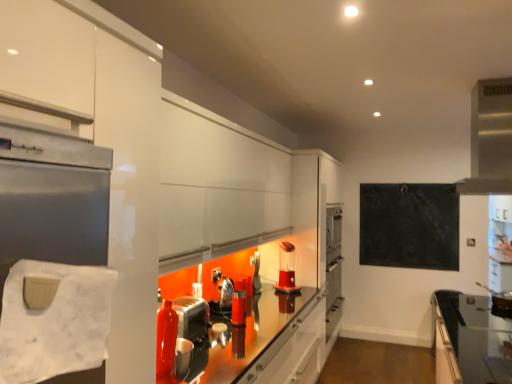
Describe the element at coordinates (470, 340) in the screenshot. The width and height of the screenshot is (512, 384). I see `black glass countertop at lower right` at that location.

At what (x,y) coordinates should I click in order to perform the action: click on metallic silver toaster at center, arranged as the 3th appliance when viewed from the back. Please return your answer as a coordinate pair (x, y). The width and height of the screenshot is (512, 384). Looking at the image, I should click on pos(238,308).

The width and height of the screenshot is (512, 384). What do you see at coordinates (490, 139) in the screenshot?
I see `satin silver exhaust hood at upper right` at bounding box center [490, 139].

What do you see at coordinates (55, 323) in the screenshot? I see `white paper towel at left` at bounding box center [55, 323].

What do you see at coordinates (221, 292) in the screenshot?
I see `shiny metallic kettle at center, the 2th appliance viewed from the back` at bounding box center [221, 292].

Identify the location of translucent plastic coffee machine at center. (287, 268).

Consider the image. Does white paper towel at left appear on the right side of shiny metallic kettle at center, the second appliance viewed from the front?

In fact, white paper towel at left is to the left of shiny metallic kettle at center, the second appliance viewed from the front.

In terms of width, does white paper towel at left look wider or thinner when compared to shiny metallic kettle at center, the second appliance viewed from the front?

Clearly, white paper towel at left has less width compared to shiny metallic kettle at center, the second appliance viewed from the front.

Which appliance is the 2nd one when counting from the back of the white paper towel at left? Please provide its 2D coordinates.

[(221, 292)]

From a real-world perspective, which is physically below, white paper towel at left or shiny metallic kettle at center, the 2th appliance viewed from the back?

shiny metallic kettle at center, the 2th appliance viewed from the back, from a real-world perspective.

Does white paper towel at left have a greater width compared to translucent plastic coffee machine at center?

No, white paper towel at left is not wider than translucent plastic coffee machine at center.

Is white paper towel at left surrounding translucent plastic coffee machine at center?

No.

From the picture: From a real-world perspective, which object rests below the other?

translucent plastic coffee machine at center.

Could you tell me if white paper towel at left is facing translucent plastic coffee machine at center?

No.

Based on the photo, from the image's perspective, is shiny metallic kettle at center, the 2th appliance viewed from the back, above or below black slate board at upper right?

Based on their image positions, shiny metallic kettle at center, the 2th appliance viewed from the back, is located beneath black slate board at upper right.

Is shiny metallic kettle at center, the 2th appliance viewed from the back, next to black slate board at upper right and touching it?

No, shiny metallic kettle at center, the 2th appliance viewed from the back, is not making contact with black slate board at upper right.

Is point (226, 285) positioned in front of point (412, 244)?

Yes, point (226, 285) is in front of point (412, 244).

From the image's perspective, would you say white paper towel at left is shown under black glass countertop at lower right?

Actually, white paper towel at left appears above black glass countertop at lower right in the image.

How far apart are white paper towel at left and black glass countertop at lower right?

white paper towel at left is 11.87 feet away from black glass countertop at lower right.

Is white paper towel at left at the left side of black glass countertop at lower right?

Correct, you'll find white paper towel at left to the left of black glass countertop at lower right.

Relative to black glass countertop at lower right, is white paper towel at left in front or behind?

white paper towel at left is in front of black glass countertop at lower right.

Does point (507, 118) come in front of point (255, 257)?

Yes, point (507, 118) is in front of point (255, 257).

Can you confirm if satin silver exhaust hood at upper right is wider than metallic silver toaster at center, which is the third appliance from front to back?

Yes.

Considering the sizes of objects satin silver exhaust hood at upper right and metallic silver toaster at center, which is the third appliance from front to back, in the image provided, who is shorter, satin silver exhaust hood at upper right or metallic silver toaster at center, which is the third appliance from front to back,?

Standing shorter between the two is metallic silver toaster at center, which is the third appliance from front to back.

In the image, is translucent plastic coffee machine at center on the left side or the right side of shiny metallic kettle at center, the second appliance viewed from the front?

Clearly, translucent plastic coffee machine at center is on the right of shiny metallic kettle at center, the second appliance viewed from the front, in the image.

Between translucent plastic coffee machine at center and shiny metallic kettle at center, the second appliance viewed from the front, which one is positioned in front?

Positioned in front is shiny metallic kettle at center, the second appliance viewed from the front.

Between point (283, 281) and point (224, 295), which one is positioned behind?

The point (283, 281) is farther from the camera.

Are translucent plastic coffee machine at center and shiny metallic kettle at center, the second appliance viewed from the front, making contact?

No, translucent plastic coffee machine at center is not making contact with shiny metallic kettle at center, the second appliance viewed from the front.

Which is more distant, (x=288, y=289) or (x=245, y=300)?

Positioned behind is point (x=288, y=289).

Based on the photo, considering the relative positions of translucent plastic coffee machine at center and metallic silver toaster at center, arranged as the 3th appliance when viewed from the back, in the image provided, is translucent plastic coffee machine at center to the left or to the right of metallic silver toaster at center, arranged as the 3th appliance when viewed from the back,?

In the image, translucent plastic coffee machine at center appears on the right side of metallic silver toaster at center, arranged as the 3th appliance when viewed from the back.

How far apart are translucent plastic coffee machine at center and metallic silver toaster at center, arranged as the 3th appliance when viewed from the back?

translucent plastic coffee machine at center is 38.43 inches from metallic silver toaster at center, arranged as the 3th appliance when viewed from the back.

Who is bigger, translucent plastic coffee machine at center or metallic silver toaster at center, which appears as the 1th appliance when viewed from the front?

Bigger between the two is translucent plastic coffee machine at center.

Find the location of a particular element. toilet paper above the shiny metallic kettle at center, the second appliance viewed from the front (from the image's perspective) is located at coordinates (55, 323).

Where is `coffee machine that is on the right side of white paper towel at left`? This screenshot has width=512, height=384. coffee machine that is on the right side of white paper towel at left is located at coordinates (287, 268).

Looking at the image, which one is located further to metallic silver toaster at center, acting as the first appliance starting from the back, satin silver exhaust hood at upper right or metallic silver toaster at center, arranged as the 3th appliance when viewed from the back?

Among the two, satin silver exhaust hood at upper right is located further to metallic silver toaster at center, acting as the first appliance starting from the back.

Which object lies further to the anchor point metallic silver toaster at center, which is the third appliance from front to back, shiny metallic kettle at center, the 2th appliance viewed from the back, or translucent plastic coffee machine at center?

shiny metallic kettle at center, the 2th appliance viewed from the back, is positioned further to the anchor metallic silver toaster at center, which is the third appliance from front to back.

Looking at the image, which one is located closer to black slate board at upper right, shiny metallic kettle at center, the 2th appliance viewed from the back, or black glass countertop at lower right?

Based on the image, black glass countertop at lower right appears to be nearer to black slate board at upper right.

Considering their positions, is metallic silver toaster at center, which is the third appliance from front to back, positioned closer to metallic silver toaster at center, which appears as the 1th appliance when viewed from the front, than white paper towel at left?

metallic silver toaster at center, which is the third appliance from front to back, is closer to metallic silver toaster at center, which appears as the 1th appliance when viewed from the front.

Considering their positions, is metallic silver toaster at center, which is the third appliance from front to back, positioned further to black glass countertop at lower right than translucent plastic coffee machine at center?

Among the two, metallic silver toaster at center, which is the third appliance from front to back, is located further to black glass countertop at lower right.

Based on their spatial positions, is metallic silver toaster at center, arranged as the 3th appliance when viewed from the back, or white paper towel at left further from shiny metallic kettle at center, the 2th appliance viewed from the back?

white paper towel at left lies further to shiny metallic kettle at center, the 2th appliance viewed from the back, than the other object.

Based on their spatial positions, is black slate board at upper right or translucent plastic coffee machine at center closer to metallic silver toaster at center, which appears as the 1th appliance when viewed from the front?

translucent plastic coffee machine at center is positioned closer to the anchor metallic silver toaster at center, which appears as the 1th appliance when viewed from the front.

From the image, which object appears to be farther from shiny metallic kettle at center, the 2th appliance viewed from the back, white paper towel at left or translucent plastic coffee machine at center?

Among the two, white paper towel at left is located further to shiny metallic kettle at center, the 2th appliance viewed from the back.

At what (x,y) coordinates should I click in order to perform the action: click on coffee machine situated between metallic silver toaster at center, arranged as the 3th appliance when viewed from the back, and satin silver exhaust hood at upper right from left to right. Please return your answer as a coordinate pair (x, y). Image resolution: width=512 pixels, height=384 pixels. Looking at the image, I should click on (287, 268).

At what (x,y) coordinates should I click in order to perform the action: click on exhaust hood located between black glass countertop at lower right and translucent plastic coffee machine at center in the depth direction. Please return your answer as a coordinate pair (x, y). Looking at the image, I should click on (490, 139).

This screenshot has height=384, width=512. In order to click on countertop between white paper towel at left and metallic silver toaster at center, acting as the first appliance starting from the back, along the z-axis in this screenshot , I will do `click(470, 340)`.

Identify the location of coffee machine located between shiny metallic kettle at center, the 2th appliance viewed from the back, and black slate board at upper right in the left-right direction. This screenshot has width=512, height=384. (287, 268).